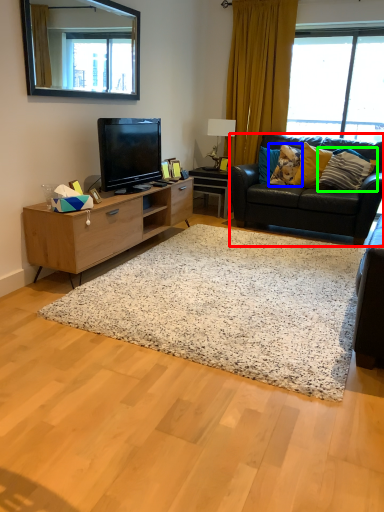
Question: Which object is the farthest from studio couch (highlighted by a red box)? Choose among these: pillow (highlighted by a blue box) or pillow (highlighted by a green box).

Choices:
 (A) pillow
 (B) pillow

Answer: (A)